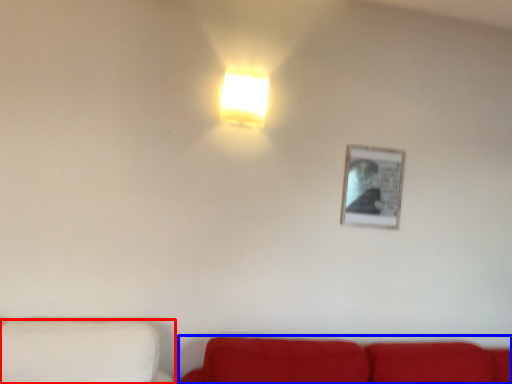
Question: Which of the following is the closest to the observer, furniture (highlighted by a red box) or studio couch (highlighted by a blue box)?

Choices:
 (A) furniture
 (B) studio couch

Answer: (A)